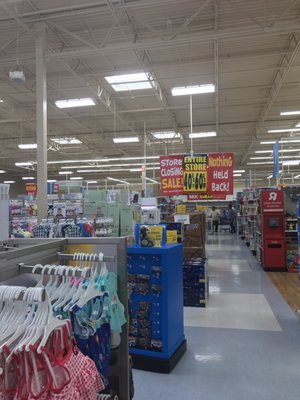
In order to click on white parts of tiled floor in this screenshot , I will do `click(247, 315)`, `click(228, 262)`, `click(225, 244)`, `click(221, 238)`.